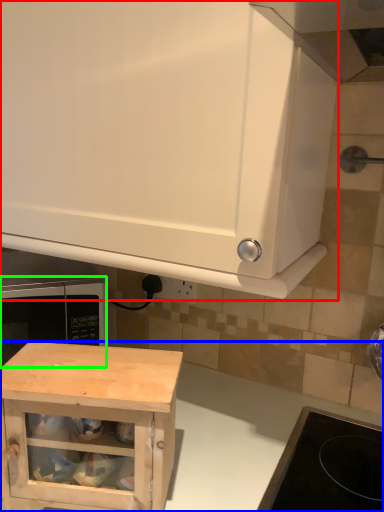
Question: Which object is the closest to the cabinetry (highlighted by a red box)? Choose among these: counter (highlighted by a blue box) or microwave oven (highlighted by a green box).

Choices:
 (A) counter
 (B) microwave oven

Answer: (A)